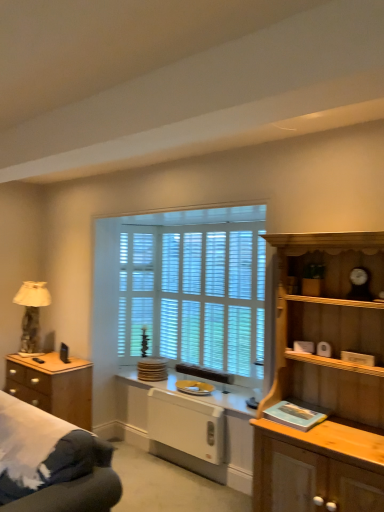
Locate an element on the screen. Image resolution: width=384 pixels, height=512 pixels. free space above white glossy radiator at lower center, arranged as the first appliance when ordered from the bottom (from a real-world perspective) is located at coordinates (179, 397).